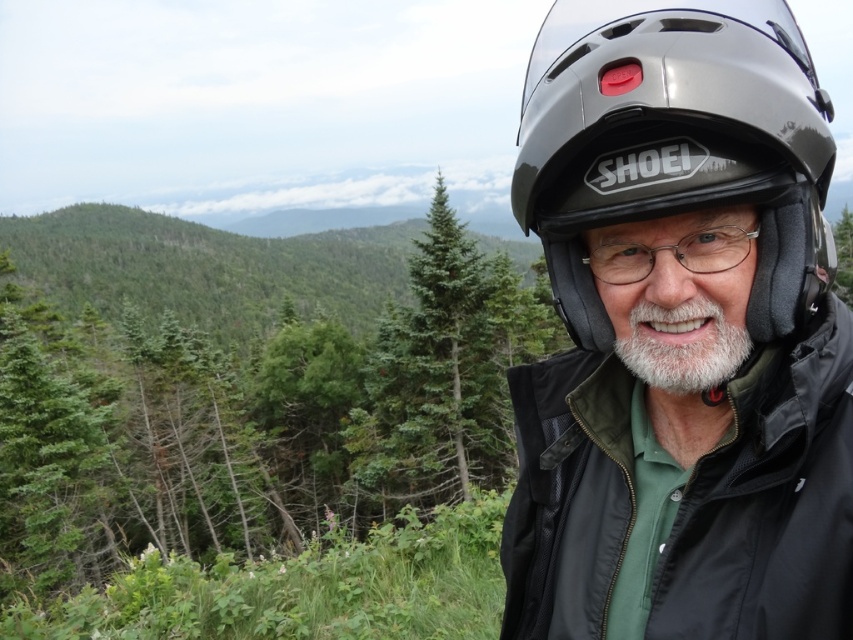
You are a photographer trying to capture a portrait of the person in the scene. You notice the black matte jacket at right and the clear plastic glasses at center. Which object is positioned higher up in the image?

The black matte jacket at right is much taller than the clear plastic glasses at center, so the black matte jacket at right is positioned higher up in the image.

You are a photographer trying to capture the black matte jacket at right in your shot. The camera is positioned at the origin point. What direction should you move the camera to include the jacket in the frame?

The black matte jacket at right is located at point 0.786 on the x axis and 0.904 on the y axis. Since the camera is at the origin, you should move the camera to the right and upwards to include the jacket in the frame.

You are a photographer trying to capture the clear plastic glasses at center and the black matte jacket at right in the same frame. Based on their positions, which object should you adjust your camera to focus on first to ensure both are in the frame?

The black matte jacket at right is to the left of clear plastic glasses at center, so you should focus on the clear plastic glasses at center first to ensure both are captured in the frame.